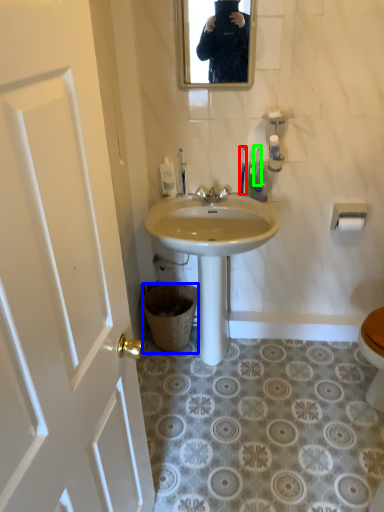
Question: Which object is the closest to the toilet brush (highlighted by a red box)? Choose among these: trash bin/can (highlighted by a blue box) or toiletry (highlighted by a green box).

Choices:
 (A) trash bin/can
 (B) toiletry

Answer: (B)